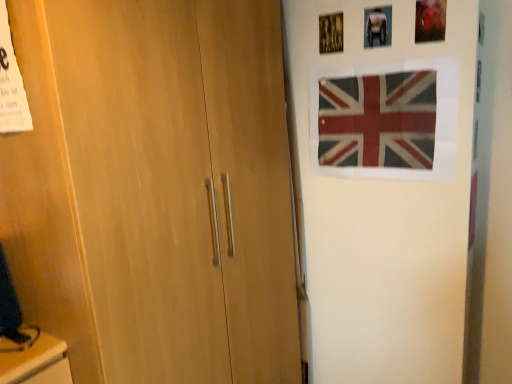
Measure the distance between point (387, 39) and camera.

The depth of point (387, 39) is 5.28 feet.

In order to face white glossy picture frame at upper center, should I rotate leftwards or rightwards?

To align with it, rotate right about 15.892°.

Looking at this image, what is the approximate width of white glossy picture frame at upper center?

0.65 inches.

The height and width of the screenshot is (384, 512). What do you see at coordinates (378, 26) in the screenshot?
I see `white glossy picture frame at upper center` at bounding box center [378, 26].

This screenshot has width=512, height=384. In order to click on white glossy picture frame at upper center in this screenshot , I will do `click(378, 26)`.

The width and height of the screenshot is (512, 384). Find the location of `textured fabric flag at upper right`. textured fabric flag at upper right is located at coordinates (378, 120).

What is the approximate height of textured fabric flag at upper right?

textured fabric flag at upper right is 15.41 inches in height.

The width and height of the screenshot is (512, 384). Describe the element at coordinates (378, 120) in the screenshot. I see `textured fabric flag at upper right` at that location.

Identify the location of white glossy picture frame at upper center. The width and height of the screenshot is (512, 384). click(378, 26).

Can you confirm if textured fabric flag at upper right is positioned to the left of white glossy picture frame at upper center?

No.

Is the position of textured fabric flag at upper right more distant than that of white glossy picture frame at upper center?

No, it is in front of white glossy picture frame at upper center.

Between point (338, 110) and point (380, 43), which one is positioned in front?

Point (380, 43)

From the image's perspective, which object appears higher, textured fabric flag at upper right or white glossy picture frame at upper center?

white glossy picture frame at upper center.

From a real-world perspective, does textured fabric flag at upper right stand above white glossy picture frame at upper center?

Incorrect, from a real-world perspective, textured fabric flag at upper right is lower than white glossy picture frame at upper center.

Does textured fabric flag at upper right have a greater width compared to white glossy picture frame at upper center?

No.

Considering the relative sizes of textured fabric flag at upper right and white glossy picture frame at upper center in the image provided, is textured fabric flag at upper right taller than white glossy picture frame at upper center?

Yes.

In terms of size, does textured fabric flag at upper right appear bigger or smaller than white glossy picture frame at upper center?

Clearly, textured fabric flag at upper right is larger in size than white glossy picture frame at upper center.

Do you think textured fabric flag at upper right is within white glossy picture frame at upper center, or outside of it?

textured fabric flag at upper right is outside white glossy picture frame at upper center.

Is textured fabric flag at upper right next to white glossy picture frame at upper center and touching it?

textured fabric flag at upper right and white glossy picture frame at upper center are not in contact.

In the scene shown: Is textured fabric flag at upper right facing away from white glossy picture frame at upper center?

No, textured fabric flag at upper right's orientation is not away from white glossy picture frame at upper center.

Can you tell me how much textured fabric flag at upper right and white glossy picture frame at upper center differ in facing direction?

They differ by 2.01 degrees in their facing directions.

The width and height of the screenshot is (512, 384). Identify the location of picture frame that appears above the textured fabric flag at upper right (from a real-world perspective). (378, 26).

Visually, is white glossy picture frame at upper center positioned to the left or to the right of textured fabric flag at upper right?

In the image, white glossy picture frame at upper center appears on the left side of textured fabric flag at upper right.

Relative to textured fabric flag at upper right, is white glossy picture frame at upper center in front or behind?

Clearly, white glossy picture frame at upper center is behind textured fabric flag at upper right.

Does point (367, 12) lie in front of point (429, 112)?

No, (367, 12) is further to viewer.

From the image's perspective, does white glossy picture frame at upper center appear higher than textured fabric flag at upper right?

Yes, from the image's perspective, white glossy picture frame at upper center is over textured fabric flag at upper right.

From a real-world perspective, between white glossy picture frame at upper center and textured fabric flag at upper right, who is vertically higher?

white glossy picture frame at upper center, from a real-world perspective.

Does white glossy picture frame at upper center have a lesser width compared to textured fabric flag at upper right?

Incorrect, the width of white glossy picture frame at upper center is not less than that of textured fabric flag at upper right.

Between white glossy picture frame at upper center and textured fabric flag at upper right, which one has less height?

Standing shorter between the two is white glossy picture frame at upper center.

Considering the sizes of objects white glossy picture frame at upper center and textured fabric flag at upper right in the image provided, who is bigger, white glossy picture frame at upper center or textured fabric flag at upper right?

With larger size is textured fabric flag at upper right.

Choose the correct answer: Is white glossy picture frame at upper center inside textured fabric flag at upper right or outside it?

white glossy picture frame at upper center is located beyond the bounds of textured fabric flag at upper right.

Is white glossy picture frame at upper center touching textured fabric flag at upper right?

No, white glossy picture frame at upper center is not making contact with textured fabric flag at upper right.

Consider the image. Is white glossy picture frame at upper center aimed at textured fabric flag at upper right?

No.

At what (x,y) coordinates should I click in order to perform the action: click on flag beneath the white glossy picture frame at upper center (from a real-world perspective). Please return your answer as a coordinate pair (x, y). Image resolution: width=512 pixels, height=384 pixels. Looking at the image, I should click on (378, 120).

Where is `flag lying below the white glossy picture frame at upper center (from the image's perspective)`? This screenshot has width=512, height=384. flag lying below the white glossy picture frame at upper center (from the image's perspective) is located at coordinates (378, 120).

This screenshot has width=512, height=384. In order to click on picture frame behind the textured fabric flag at upper right in this screenshot , I will do point(378,26).